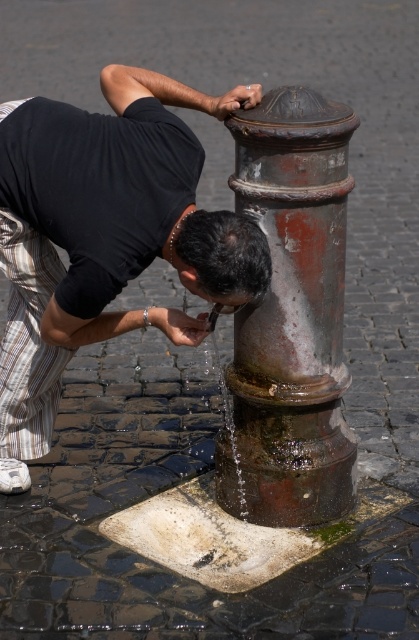
You are a photographer capturing the scene from the street level. You notice the matte black shirt at left and the rusty metal hydrant at center. Which object is positioned higher in the image?

The matte black shirt at left is above the rusty metal hydrant at center, so it is positioned higher in the image.

You are a photographer trying to capture the man and the hydrant in a single frame. Given that the matte black shirt at left is wider than the rusty metal hydrant at center, which object should you adjust your camera focus to ensure both are fully visible without cropping?

Since the matte black shirt at left is wider than the rusty metal hydrant at center, you should focus on the wider object, the matte black shirt at left, to ensure both fit in the frame without cropping.